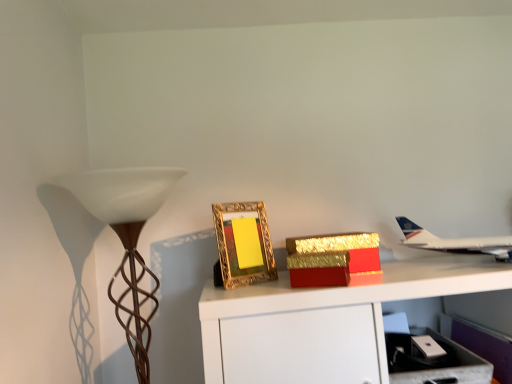
Question: From a real-world perspective, does brown textured lamp at left stand above metallic silver drawer at lower right?

Choices:
 (A) no
 (B) yes

Answer: (B)

Question: Is brown textured lamp at left bigger than metallic silver drawer at lower right?

Choices:
 (A) yes
 (B) no

Answer: (A)

Question: Is brown textured lamp at left to the left of metallic silver drawer at lower right from the viewer's perspective?

Choices:
 (A) yes
 (B) no

Answer: (A)

Question: Does brown textured lamp at left lie behind metallic silver drawer at lower right?

Choices:
 (A) yes
 (B) no

Answer: (B)

Question: From the image's perspective, would you say brown textured lamp at left is shown under metallic silver drawer at lower right?

Choices:
 (A) no
 (B) yes

Answer: (A)

Question: From a real-world perspective, is brown textured lamp at left beneath metallic silver drawer at lower right?

Choices:
 (A) no
 (B) yes

Answer: (A)

Question: Is metallic silver drawer at lower right to the left of white metallic airplane at upper right from the viewer's perspective?

Choices:
 (A) no
 (B) yes

Answer: (B)

Question: Could you tell me if metallic silver drawer at lower right is facing white metallic airplane at upper right?

Choices:
 (A) no
 (B) yes

Answer: (A)

Question: Is metallic silver drawer at lower right in front of white metallic airplane at upper right?

Choices:
 (A) no
 (B) yes

Answer: (B)

Question: From the image's perspective, is metallic silver drawer at lower right below white metallic airplane at upper right?

Choices:
 (A) no
 (B) yes

Answer: (B)

Question: Does metallic silver drawer at lower right come behind white metallic airplane at upper right?

Choices:
 (A) no
 (B) yes

Answer: (A)

Question: Can you confirm if metallic silver drawer at lower right is wider than white metallic airplane at upper right?

Choices:
 (A) yes
 (B) no

Answer: (B)

Question: Is metallic silver drawer at lower right to the right of gold ornate frame at center from the viewer's perspective?

Choices:
 (A) no
 (B) yes

Answer: (B)